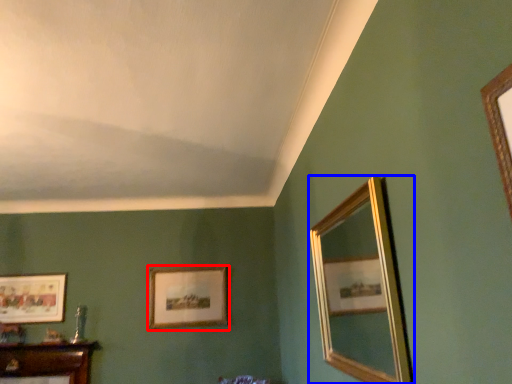
Question: Among these objects, which one is farthest to the camera, picture frame (highlighted by a red box) or mirror (highlighted by a blue box)?

Choices:
 (A) picture frame
 (B) mirror

Answer: (A)